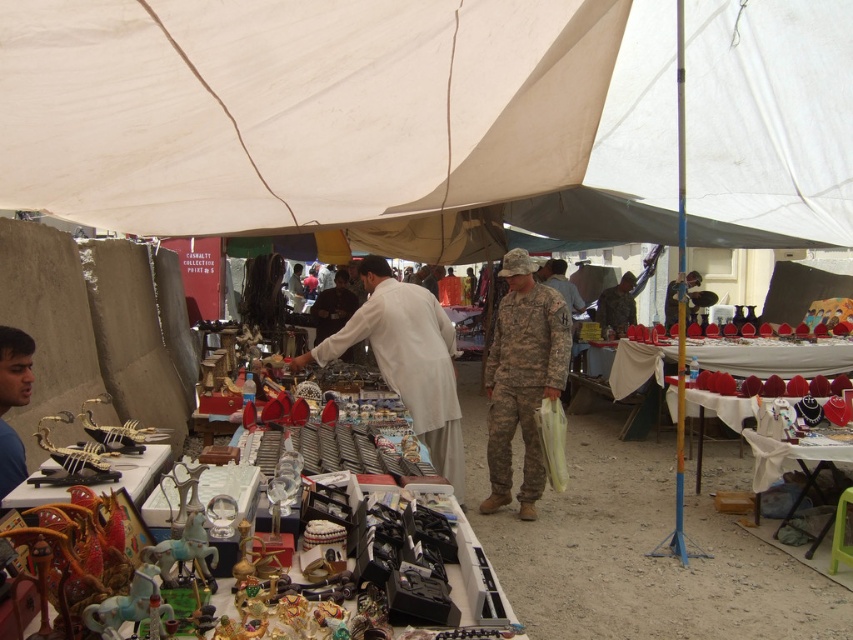
Consider the image. Is white fabric canopy at upper center above white matte clothing at center?

Yes.

Does white fabric canopy at upper center have a smaller size compared to white matte clothing at center?

Incorrect, white fabric canopy at upper center is not smaller in size than white matte clothing at center.

Identify the location of white fabric canopy at upper center. (340, 113).

Find the location of a particular element. This screenshot has height=640, width=853. white fabric canopy at upper center is located at coordinates (340, 113).

Does white fabric canopy at upper center appear on the right side of camouflage uniform at center?

Result: In fact, white fabric canopy at upper center is to the left of camouflage uniform at center.

Locate an element on the screen. white fabric canopy at upper center is located at coordinates (340, 113).

The width and height of the screenshot is (853, 640). In order to click on white fabric canopy at upper center in this screenshot , I will do `click(340, 113)`.

Is white matte clothing at center thinner than camouflage uniform at center?

No, white matte clothing at center is not thinner than camouflage uniform at center.

Is point (396, 321) behind point (520, 260)?

No, (396, 321) is closer to viewer.

The width and height of the screenshot is (853, 640). I want to click on white matte clothing at center, so click(x=407, y=360).